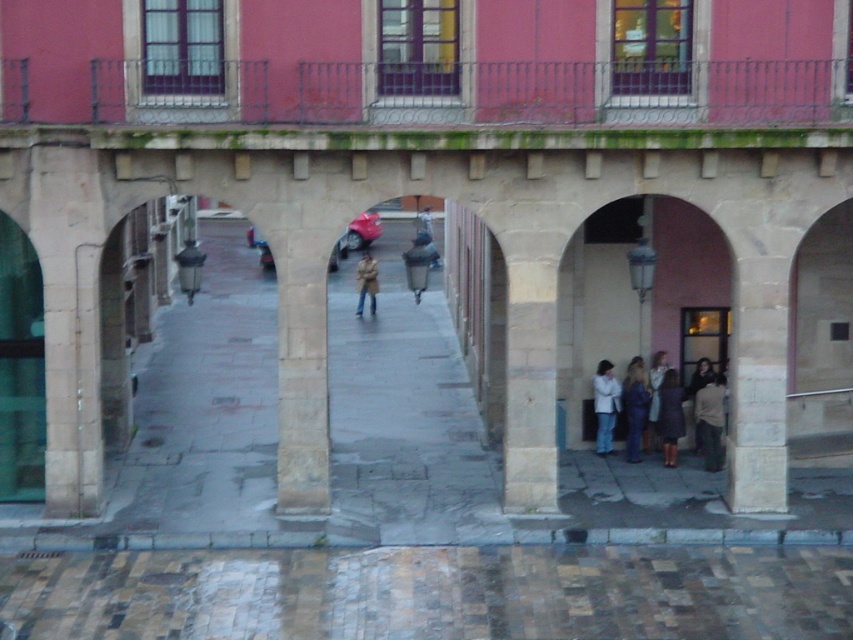
Question: Which is nearer to the denim jacket at lower right?

Choices:
 (A) white matte jacket at lower right
 (B) white textured coat at lower right
 (C) tan leather jacket at center
 (D) light brown fabric jacket at lower right

Answer: (B)

Question: Which of the following is the farthest from the observer?

Choices:
 (A) white textured coat at lower right
 (B) brown leather jacket at center
 (C) light brown fabric jacket at lower right
 (D) tan leather jacket at center

Answer: (D)

Question: Can you confirm if dark blue fabric dress at lower right is positioned below dark brown leather coat at lower right?

Choices:
 (A) yes
 (B) no

Answer: (A)

Question: Does light brown fabric jacket at lower right appear on the left side of brown leather jacket at center?

Choices:
 (A) yes
 (B) no

Answer: (B)

Question: Among these objects, which one is nearest to the camera?

Choices:
 (A) brown leather jacket at center
 (B) tan leather jacket at center
 (C) light brown fabric jacket at lower right
 (D) white matte jacket at lower right

Answer: (A)

Question: Can you confirm if denim jacket at lower right is bigger than dark brown leather coat at lower right?

Choices:
 (A) no
 (B) yes

Answer: (B)